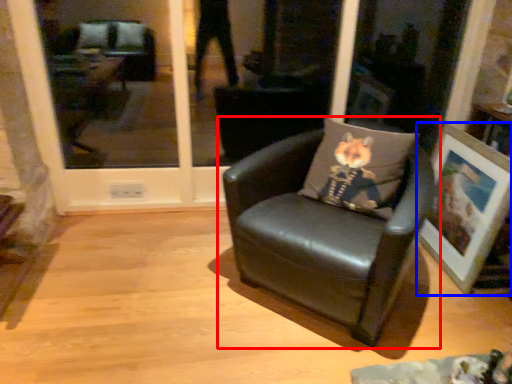
Question: Which point is further to the camera, chair (highlighted by a red box) or picture frame (highlighted by a blue box)?

Choices:
 (A) chair
 (B) picture frame

Answer: (B)